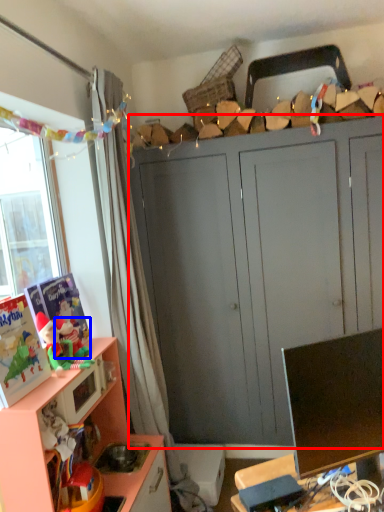
Question: Which object appears farthest to the camera in this image, cabinetry (highlighted by a red box) or toy (highlighted by a blue box)?

Choices:
 (A) cabinetry
 (B) toy

Answer: (A)